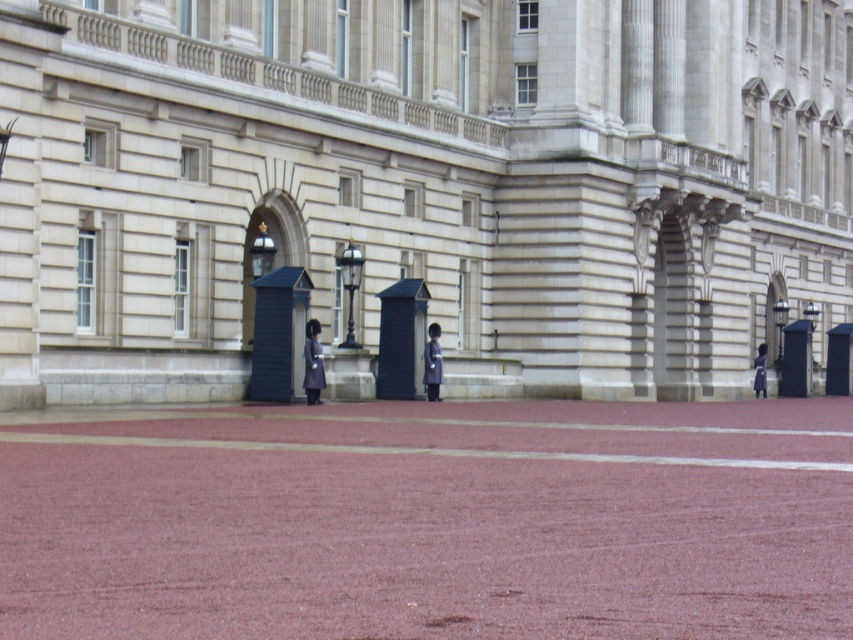
Is shiny black uniform at center taller than dark blue uniform at center?

Correct, shiny black uniform at center is much taller as dark blue uniform at center.

Does shiny black uniform at center appear over dark blue uniform at center?

Correct, shiny black uniform at center is located above dark blue uniform at center.

Describe the element at coordinates (312, 364) in the screenshot. I see `shiny black uniform at center` at that location.

The width and height of the screenshot is (853, 640). Identify the location of shiny black uniform at center. (312, 364).

Is smooth stone building at center taller than shiny dark blue uniform at center?

Yes.

Can you confirm if smooth stone building at center is positioned to the left of shiny dark blue uniform at center?

No, smooth stone building at center is not to the left of shiny dark blue uniform at center.

Which is in front, point (833, 300) or point (438, 332)?

Positioned in front is point (438, 332).

Locate an element on the screen. smooth stone building at center is located at coordinates pyautogui.click(x=424, y=180).

Can you confirm if smooth stone building at center is wider than shiny black uniform at center?

Yes.

Which is in front, point (735, 200) or point (306, 397)?

Point (306, 397)

The width and height of the screenshot is (853, 640). Identify the location of smooth stone building at center. (424, 180).